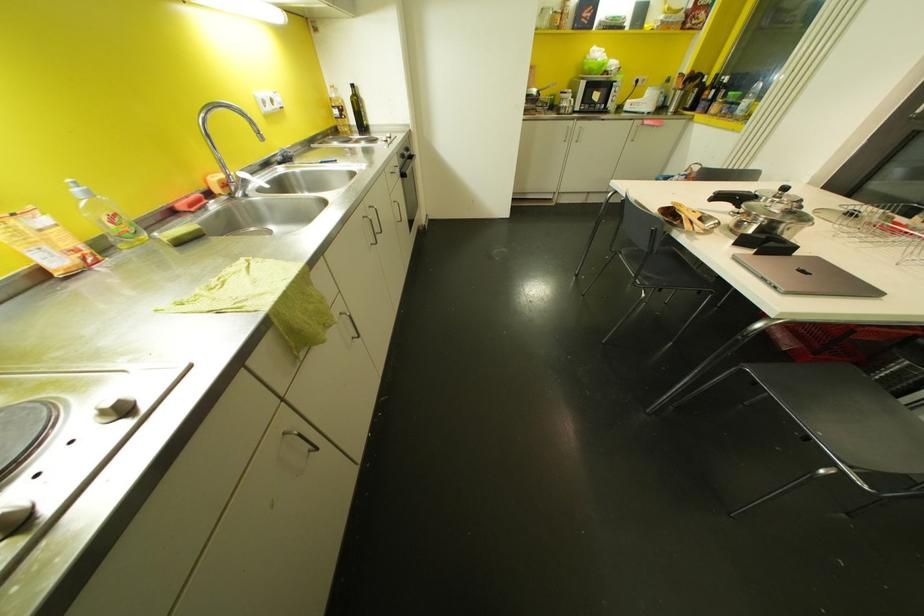
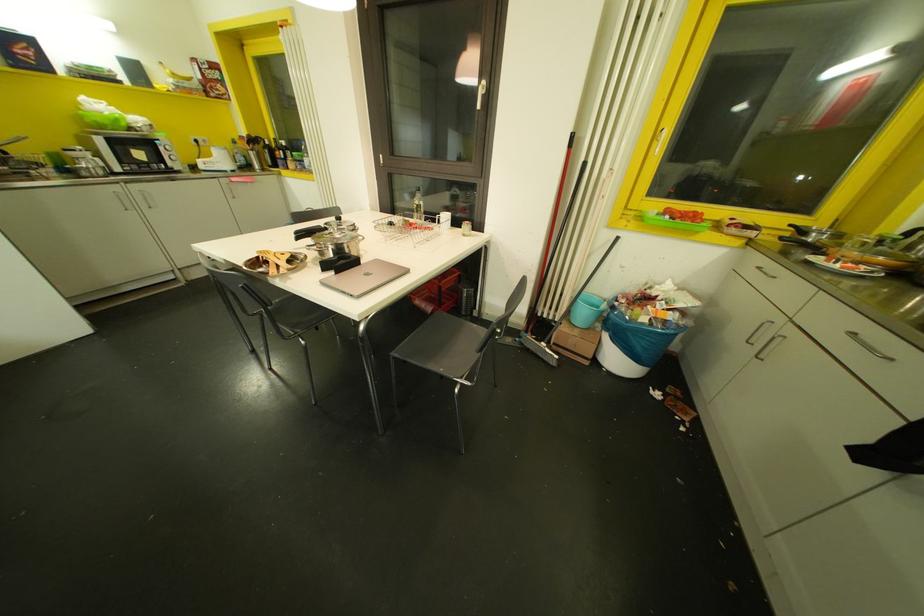
Question: The camera is either moving clockwise (left) or counter-clockwise (right) around the object. The first image is from the beginning of the video and the second image is from the end. Is the camera moving left or right when shooting the video?

Choices:
 (A) Left
 (B) Right

Answer: (A)